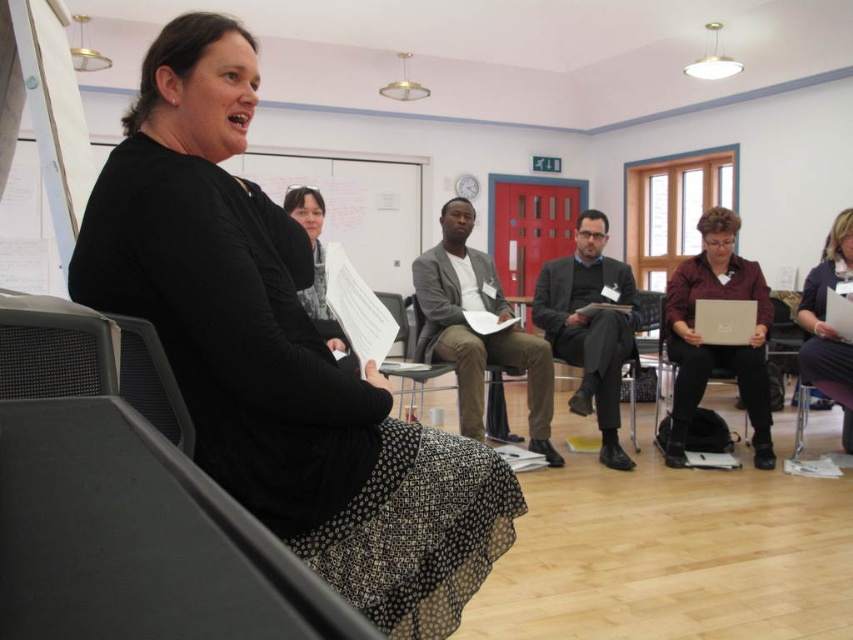
Question: Is black textured dress at left further to the viewer compared to white matte laptop at center?

Choices:
 (A) yes
 (B) no

Answer: (B)

Question: Is black textured dress at left above matte brown jacket at center?

Choices:
 (A) no
 (B) yes

Answer: (A)

Question: Which point is closer to the camera?

Choices:
 (A) purple fabric skirt at lower right
 (B) gray fabric suit at center
 (C) metallic gray chair at center

Answer: (A)

Question: Which of the following is the closest to the observer?

Choices:
 (A) dark gray suit at center
 (B) black textured dress at left
 (C) gray fabric suit at center

Answer: (B)

Question: Does gray fabric suit at center appear on the left side of purple fabric skirt at lower right?

Choices:
 (A) yes
 (B) no

Answer: (A)

Question: Which point is farther from the camera taking this photo?

Choices:
 (A) [x=624, y=348]
 (B) [x=723, y=310]
 (C) [x=505, y=433]

Answer: (C)